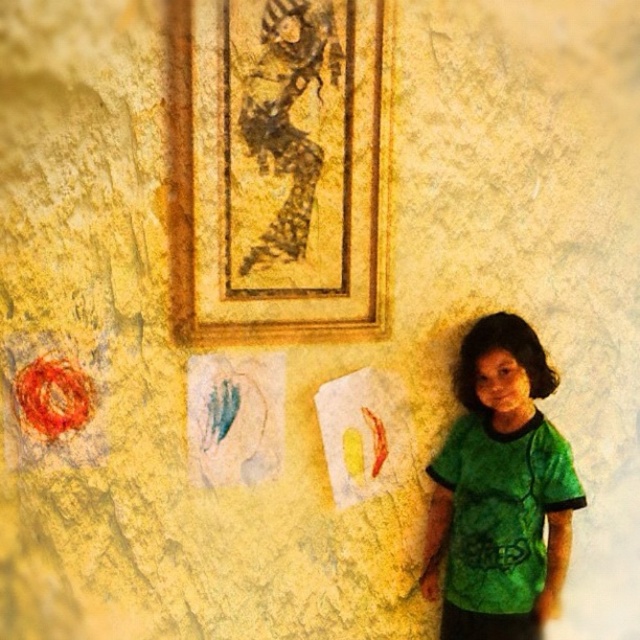
From the picture: You are standing in front of the wall with the framed artwork and the smaller drawings. There are two points marked on the wall at coordinates point (186,148) and point (522,417). Which point is closer to you?

Point (186,148) is in front of point (522,417), so it is closer to you.